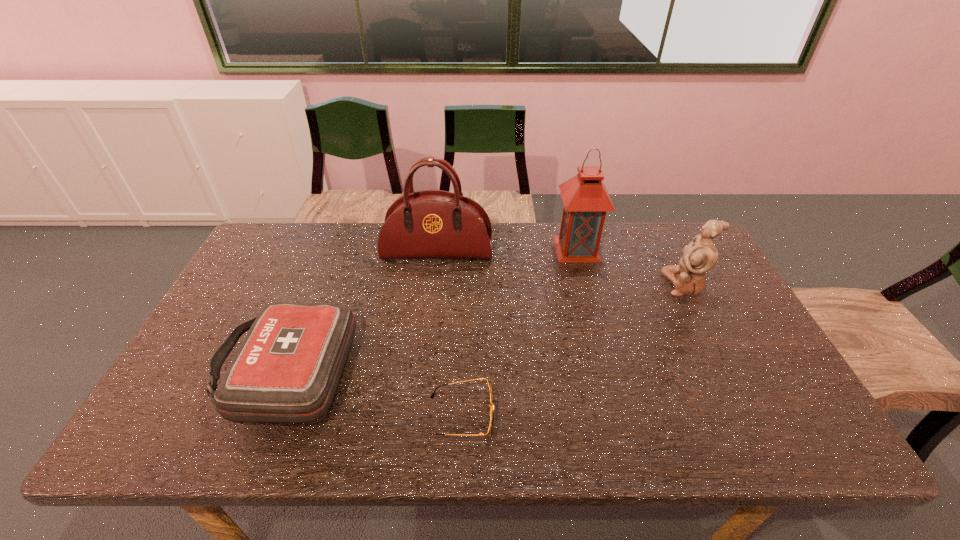
At what (x,y) coordinates should I click in order to perform the action: click on object present at the near left corner. Please return your answer as a coordinate pair (x, y). The image size is (960, 540). Looking at the image, I should click on (287, 370).

You are a GUI agent. You are given a task and a screenshot of the screen. Output one action in this format:
    pyautogui.click(x=<x>, y=<y>)
    Task: Click on the vacant area at the far edge
    The image size is (960, 540).
    Given the screenshot: What is the action you would take?
    pyautogui.click(x=304, y=258)

Locate an element on the screen. free location at the near edge of the desktop is located at coordinates (249, 430).

In the image, there is a desktop. Where is `vacant space at the left edge`? vacant space at the left edge is located at coordinates (289, 272).

In order to click on free space at the right edge in this screenshot , I will do `click(739, 398)`.

Identify the location of free space at the far right corner. (663, 227).

Where is `free point between the figurine and the first-aid kit`? free point between the figurine and the first-aid kit is located at coordinates (485, 327).

At what (x,y) coordinates should I click in order to perform the action: click on vacant area between the second shortest object and the sunglasses. Please return your answer as a coordinate pair (x, y). Looking at the image, I should click on (373, 393).

Where is `vacant area between the fourth object from left to right and the first-aid kit`? vacant area between the fourth object from left to right and the first-aid kit is located at coordinates (431, 309).

Where is `free spot between the third farthest object and the shortest object`? free spot between the third farthest object and the shortest object is located at coordinates (573, 350).